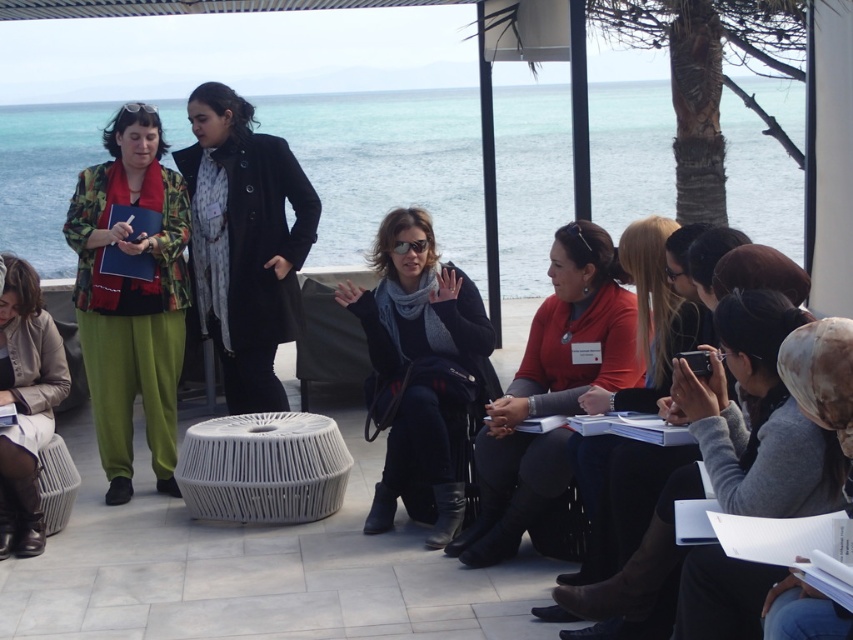
Question: Estimate the real-world distances between objects in this image. Which object is farther from the matte orange sweater at center?

Choices:
 (A) green cotton pants at left
 (B) beige leather jacket at lower left
 (C) black wool coat at center
 (D) dark gray knit sweater at center

Answer: (B)

Question: Which object appears farthest from the camera in this image?

Choices:
 (A) matte black jacket at center
 (B) green cotton pants at left

Answer: (B)

Question: From the image, what is the correct spatial relationship of gray knit sweater at lower right in relation to black wool coat at center?

Choices:
 (A) above
 (B) below

Answer: (B)

Question: Does clear blue water at upper center lie in front of black wool coat at center?

Choices:
 (A) yes
 (B) no

Answer: (B)

Question: Is green cotton pants at left closer to the viewer compared to matte black jacket at center?

Choices:
 (A) no
 (B) yes

Answer: (A)

Question: Which point is farther to the camera?

Choices:
 (A) white woven table at center
 (B) gray knit sweater at lower right

Answer: (A)